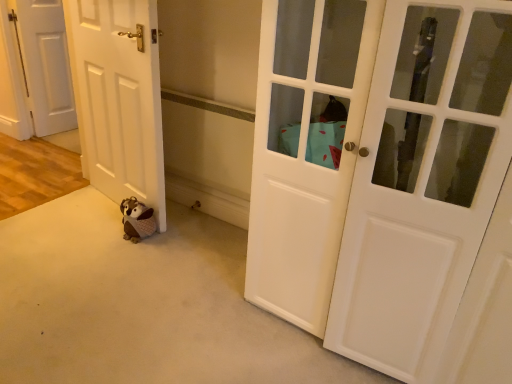
This screenshot has height=384, width=512. I want to click on free space to the left of plush brown bear at lower left, so click(101, 233).